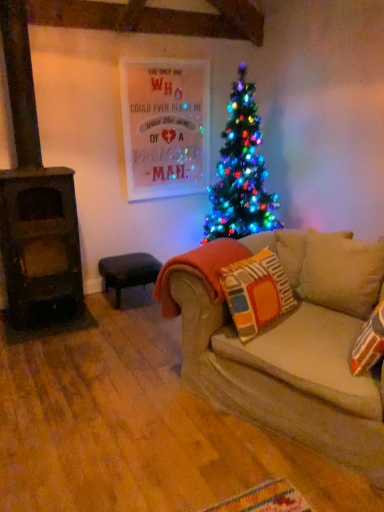
Question: In terms of height, does orange fleece blanket at center look taller or shorter compared to velvet dark blue stool at lower left?

Choices:
 (A) short
 (B) tall

Answer: (B)

Question: From a real-world perspective, is orange fleece blanket at center physically located above or below velvet dark blue stool at lower left?

Choices:
 (A) below
 (B) above

Answer: (B)

Question: Relative to velvet dark blue stool at lower left, is orange fleece blanket at center in front or behind?

Choices:
 (A) front
 (B) behind

Answer: (A)

Question: Is velvet dark blue stool at lower left taller or shorter than orange fleece blanket at center?

Choices:
 (A) tall
 (B) short

Answer: (B)

Question: From a real-world perspective, relative to orange fleece blanket at center, is velvet dark blue stool at lower left vertically above or below?

Choices:
 (A) above
 (B) below

Answer: (B)

Question: In the image, is velvet dark blue stool at lower left on the left side or the right side of orange fleece blanket at center?

Choices:
 (A) right
 (B) left

Answer: (B)

Question: Looking at the image, does velvet dark blue stool at lower left seem bigger or smaller compared to orange fleece blanket at center?

Choices:
 (A) small
 (B) big

Answer: (B)